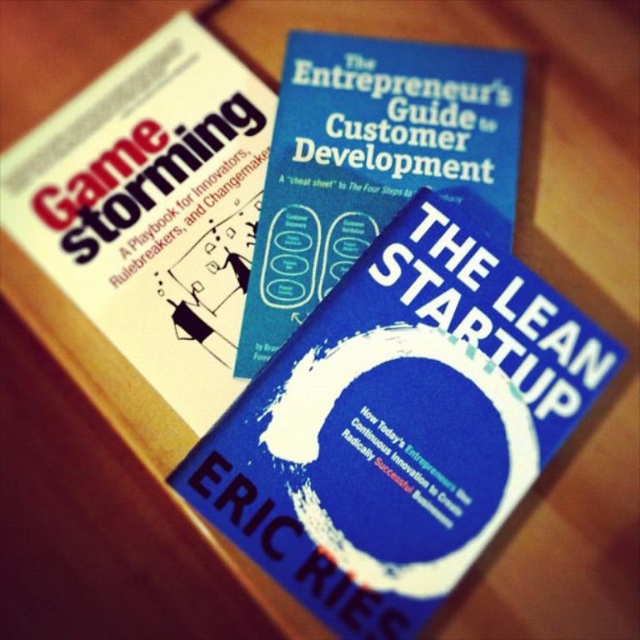
What is the location of the point with coordinates (152, 209) in the image?

The point with coordinates (152, 209) is located on the white paper book cover at upper left.

You are organizing a bookshelf and need to place the white paper book cover at upper left and the blue matte book at center. Based on their positions in the image, which book should you place first if you want to arrange them from closest to farthest from the viewer?

You should place the white paper book cover at upper left first because it is closer to the viewer than the blue matte book at center.

You are standing in front of a bookshelf and see the white paper book cover at upper left. If you want to reach it, will you need to stand on a stool? Please explain your reasoning based on the bookshelf height and the book position.

The white paper book cover at upper left is 1.04 meters from the viewer. If the standard bookshelf height is around 1.5 meters, then 1.04 meters is below that, so you might not need a stool. However, individual arm reach varies, so it depends on your height.